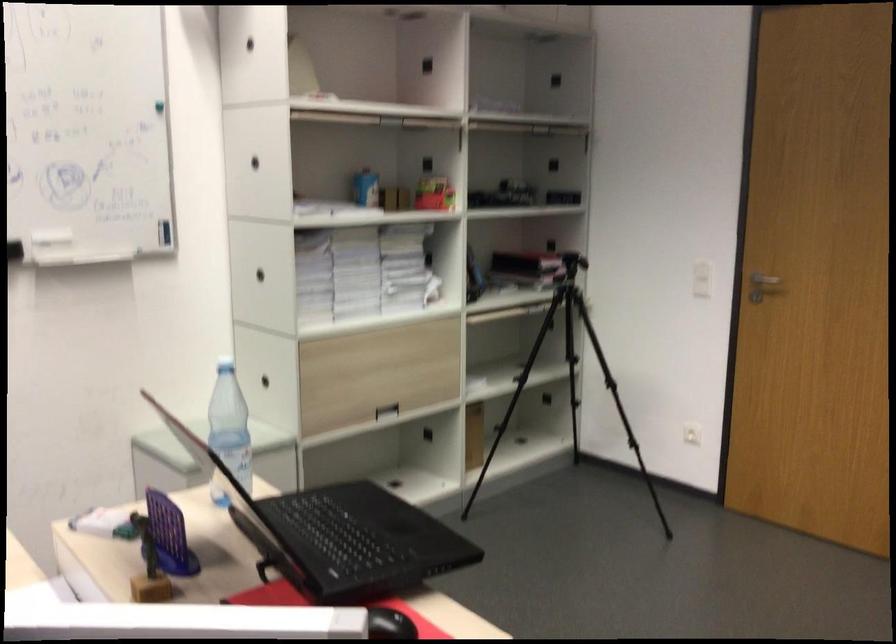
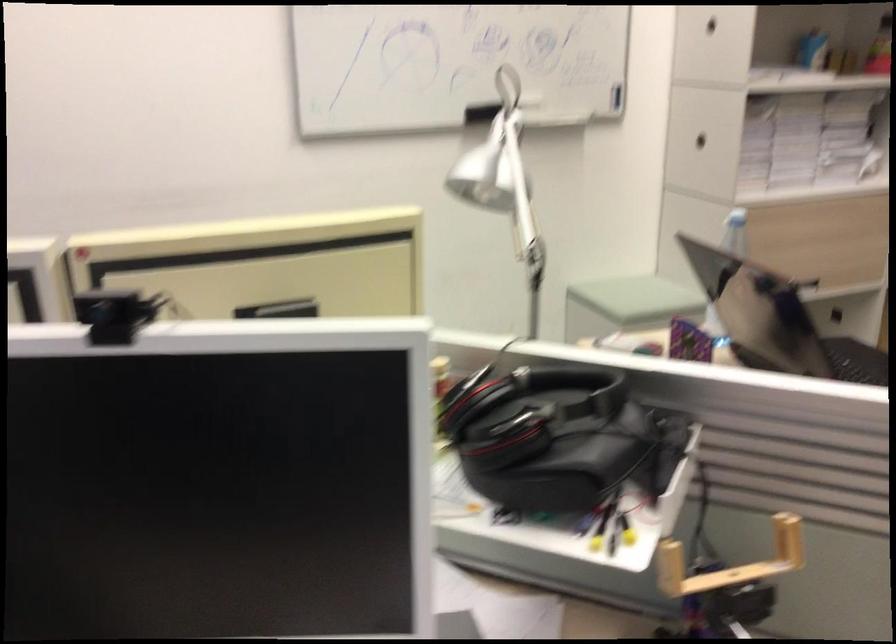
Locate, in the second image, the point that corresponds to the point at 299,368 in the first image.

(735, 232)